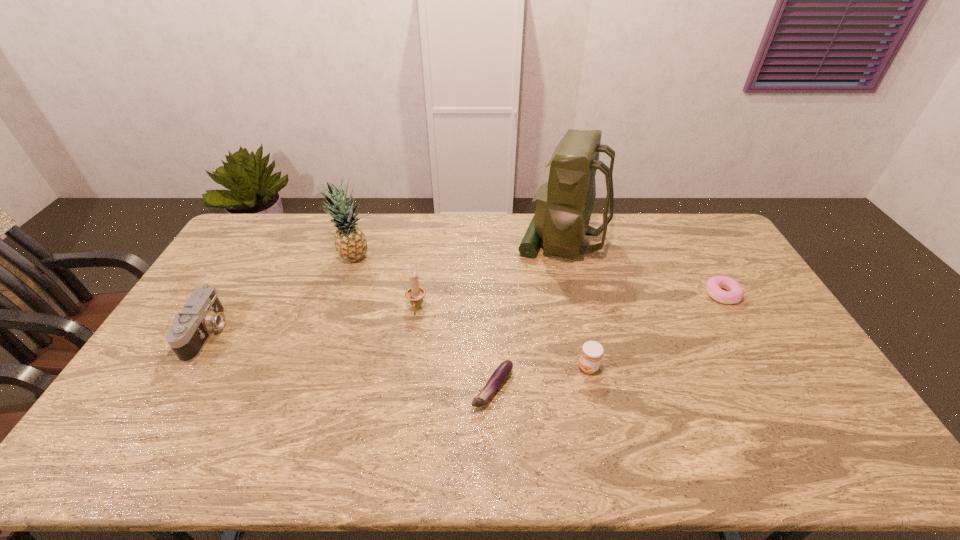
This screenshot has height=540, width=960. Identify the location of the fifth closest object to the tallest object. (350, 242).

I want to click on free spot that satisfies the following two spatial constraints: 1. on the handle side of the third tallest object; 2. on the left side of the eggplant, so click(x=405, y=388).

The height and width of the screenshot is (540, 960). I want to click on vacant area in the image that satisfies the following two spatial constraints: 1. on the lens of the leftmost object; 2. on the back side of the fourth object from right to left, so click(174, 388).

The width and height of the screenshot is (960, 540). I want to click on free location that satisfies the following two spatial constraints: 1. on the front label of the jam; 2. on the front side of the fourth object from right to left, so click(x=593, y=388).

Where is `free space that satisfies the following two spatial constraints: 1. on the handle side of the candle_holder; 2. on the lens of the fourth shortest object`? The image size is (960, 540). free space that satisfies the following two spatial constraints: 1. on the handle side of the candle_holder; 2. on the lens of the fourth shortest object is located at coordinates (413, 333).

The image size is (960, 540). I want to click on free space that satisfies the following two spatial constraints: 1. on the front of the tallest object with visible pockets; 2. on the front side of the sixth object from right to left, so click(x=566, y=258).

Where is `vacant area in the image that satisfies the following two spatial constraints: 1. on the handle side of the third object from left to right; 2. on the lens of the camera`? The image size is (960, 540). vacant area in the image that satisfies the following two spatial constraints: 1. on the handle side of the third object from left to right; 2. on the lens of the camera is located at coordinates (413, 333).

Identify the location of vacant space that satisfies the following two spatial constraints: 1. on the handle side of the candle_holder; 2. on the lens of the fourth shortest object. (413, 333).

Identify the location of vacant point that satisfies the following two spatial constraints: 1. on the handle side of the eggplant; 2. on the left side of the fifth object from right to left. (405, 388).